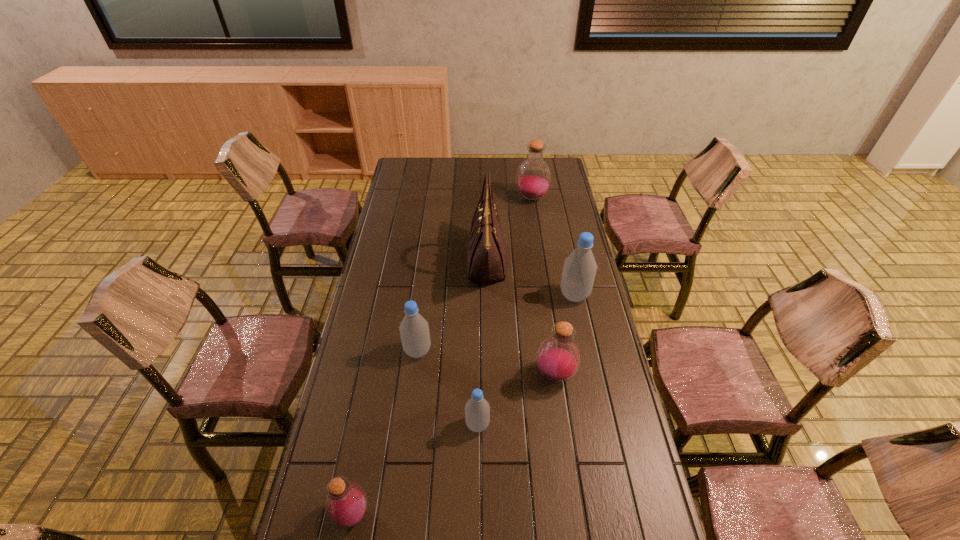
Point out which object is positioned as the fifth nearest to the farthest bottle. Please provide its 2D coordinates. Your answer should be formatted as a tuple, i.e. [(x, y)], where the tuple contains the x and y coordinates of a point satisfying the conditions above.

[(477, 410)]

Select which bottle appears as the third closest to the farthest bottle. Please provide its 2D coordinates. Your answer should be formatted as a tuple, i.e. [(x, y)], where the tuple contains the x and y coordinates of a point satisfying the conditions above.

[(558, 358)]

Identify the location of bottle object that ranks as the closest to the nearest gray bottle. This screenshot has width=960, height=540. (558, 358).

You are a GUI agent. You are given a task and a screenshot of the screen. Output one action in this format:
    pyautogui.click(x=<x>, y=<y>)
    Task: Click on the second closest gray bottle to the tallest object
    The width and height of the screenshot is (960, 540).
    Given the screenshot: What is the action you would take?
    pyautogui.click(x=414, y=330)

The height and width of the screenshot is (540, 960). Identify the location of gray bottle that is the closest to the nearest purple bottle. 477,410.

Identify the location of purple bottle that stands as the closest to the second farthest bottle. Image resolution: width=960 pixels, height=540 pixels. (558, 358).

Select which purple bottle is the closest to the second farthest gray bottle. Please provide its 2D coordinates. Your answer should be formatted as a tuple, i.e. [(x, y)], where the tuple contains the x and y coordinates of a point satisfying the conditions above.

[(558, 358)]

This screenshot has height=540, width=960. In order to click on free space that satisfies the following two spatial constraints: 1. on the back side of the farthest purple bottle; 2. on the left side of the second biggest purple bottle in this screenshot , I will do `click(530, 198)`.